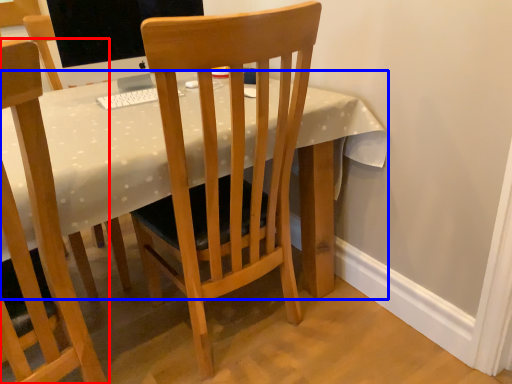
Question: Which object appears farthest to the camera in this image, chair (highlighted by a red box) or desk (highlighted by a blue box)?

Choices:
 (A) chair
 (B) desk

Answer: (B)